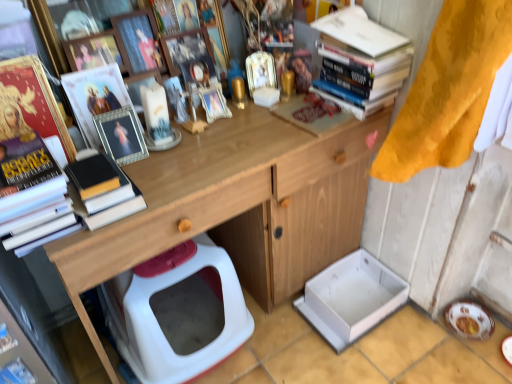
Question: From a real-world perspective, is white plastic toilet at lower center positioned above or below gold metallic bottle at center?

Choices:
 (A) below
 (B) above

Answer: (A)

Question: Is white plastic toilet at lower center in front of or behind gold metallic bottle at center in the image?

Choices:
 (A) behind
 (B) front

Answer: (B)

Question: Which object is positioned closest to the white cardboard box at lower center?

Choices:
 (A) hardcover books at upper right, the first book viewed from the right
 (B) metallic silver picture frame at upper left, placed as the first picture frame when sorted from bottom to top
 (C) wooden picture frame at upper center, the 3th picture frame from the bottom
 (D) gold metallic bottle at center
 (E) metallic silver photo frame at upper center

Answer: (A)

Question: Which object is the closest to the white plastic toilet at lower center?

Choices:
 (A) metallic silver picture frame at upper left, which appears as the 4th picture frame when viewed from the top
 (B) white glossy plate at lower right
 (C) blue paper magazine at lower left
 (D) matte gold book at upper left, placed as the 2th book when sorted from right to left
 (E) metallic silver photo frame at upper center

Answer: (C)